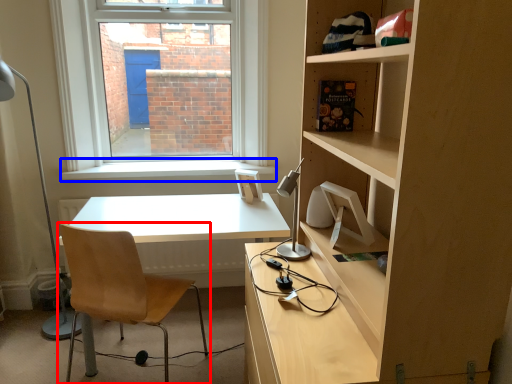
Question: Which point is further to the camera, chair (highlighted by a red box) or window sill (highlighted by a blue box)?

Choices:
 (A) chair
 (B) window sill

Answer: (B)